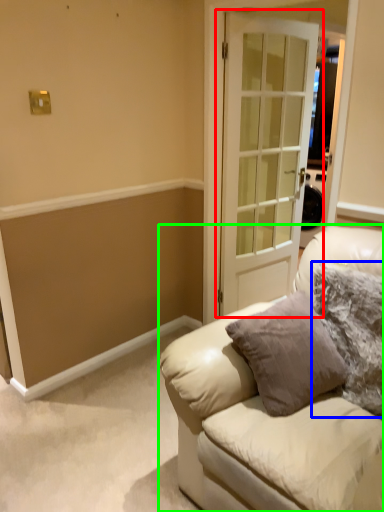
Question: Which object is positioned farthest from door (highlighted by a red box)? Select from pillow (highlighted by a blue box) and studio couch (highlighted by a green box).

Choices:
 (A) pillow
 (B) studio couch

Answer: (B)